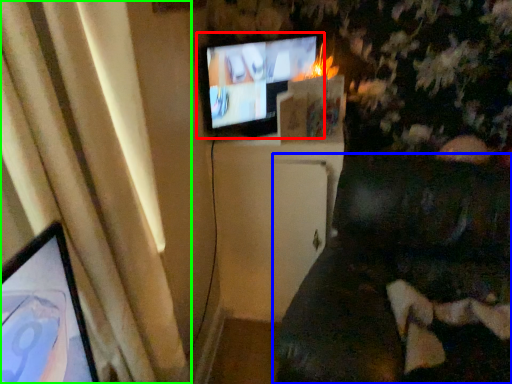
Question: Which object is positioned farthest from television (highlighted by a red box)? Select from furniture (highlighted by a blue box) and curtain (highlighted by a green box).

Choices:
 (A) furniture
 (B) curtain

Answer: (B)